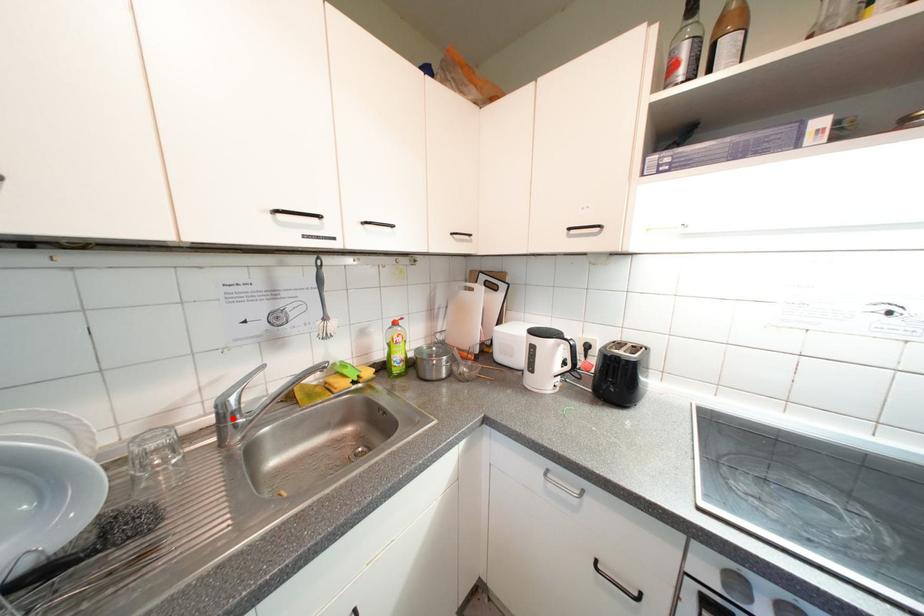
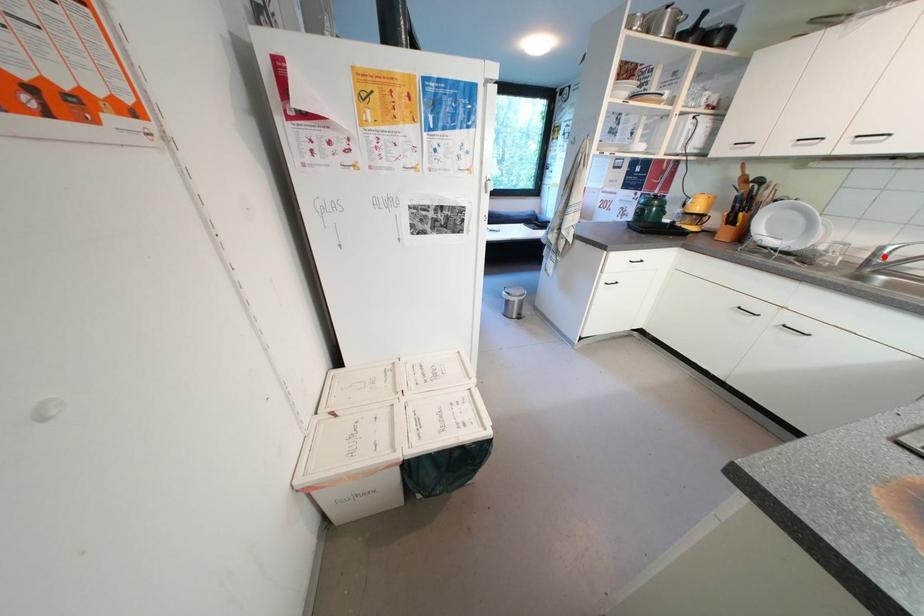
I am providing you with two images of the same scene from different viewpoints. A red point is marked on the first image and another point is marked on the second image. Do the highlighted points in image1 and image2 indicate the same real-world spot?

Yes